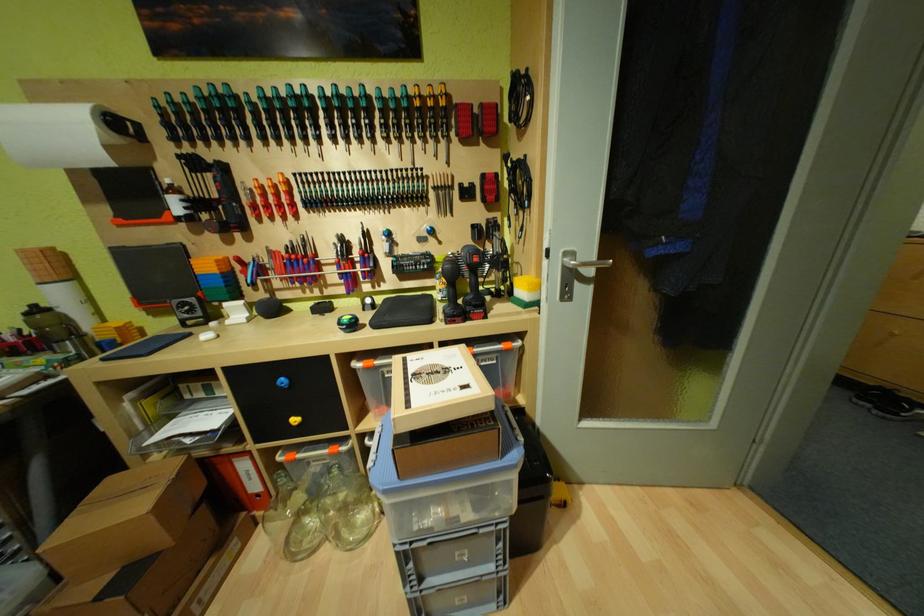
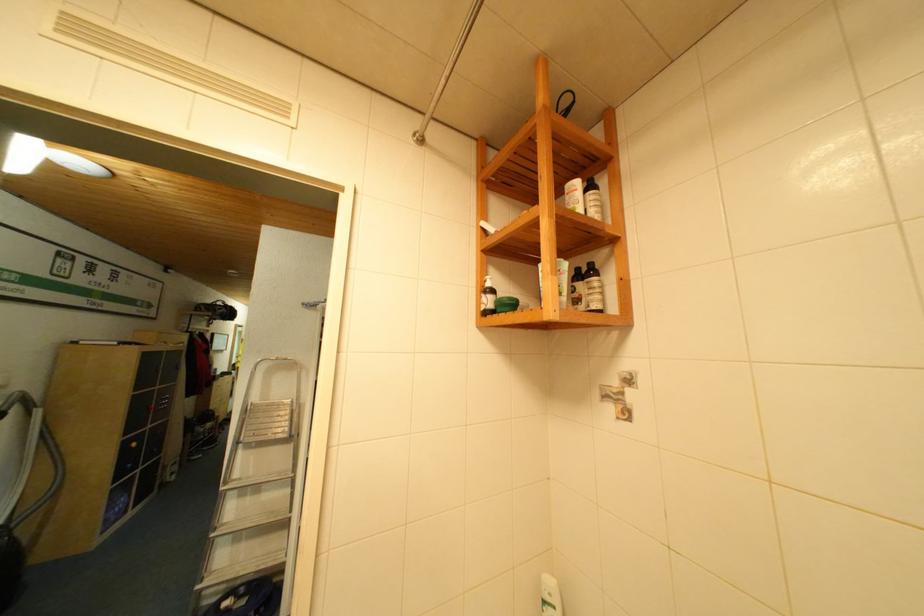
Question: I am providing you with two images of the same scene from different viewpoints. After the viewpoint changes to image2, which objects are now occluded?

Choices:
 (A) dark brown bottle
 (B) cardboard box
 (C) white door hook
 (D) white pump bottle

Answer: (B)